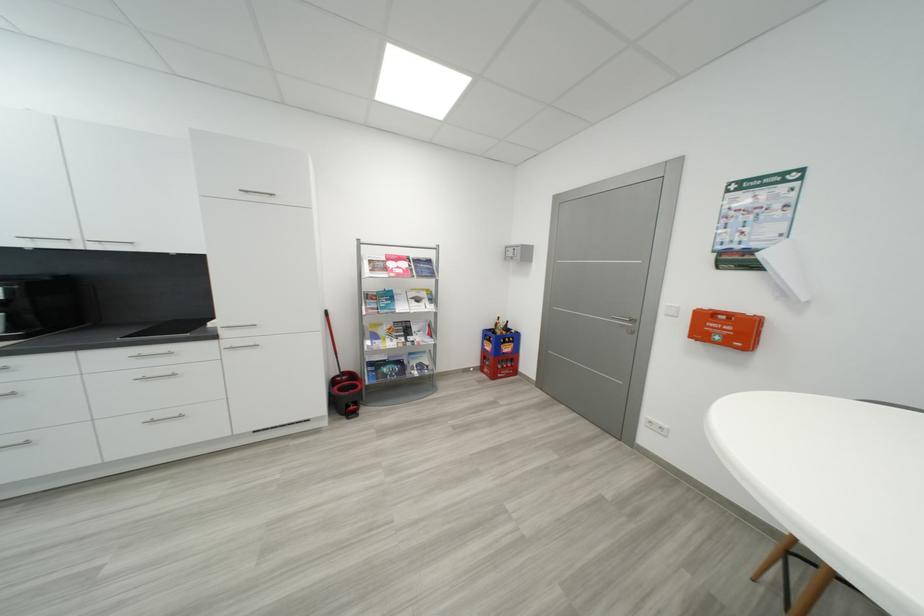
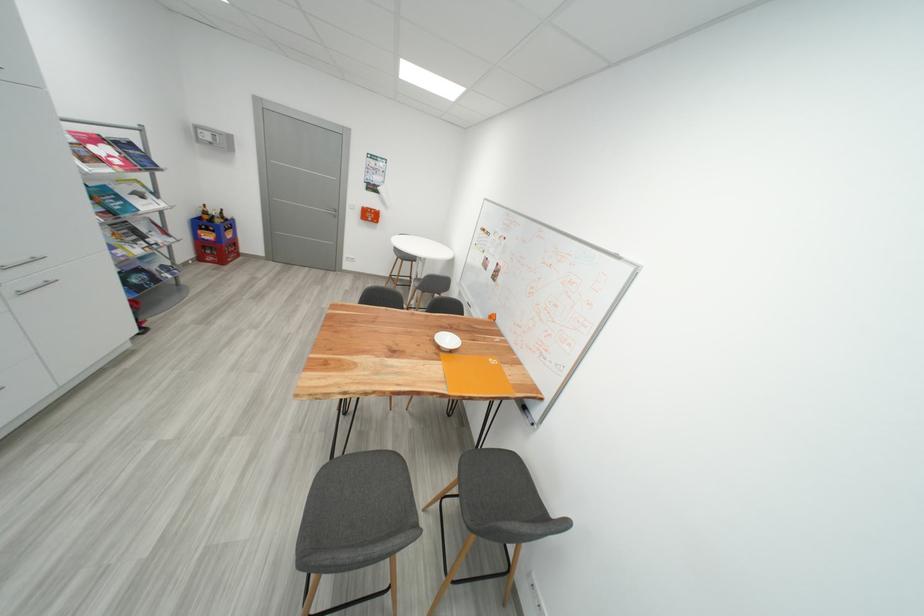
Find the pixel in the second image that matches pixel 505 334 in the first image.

(225, 223)